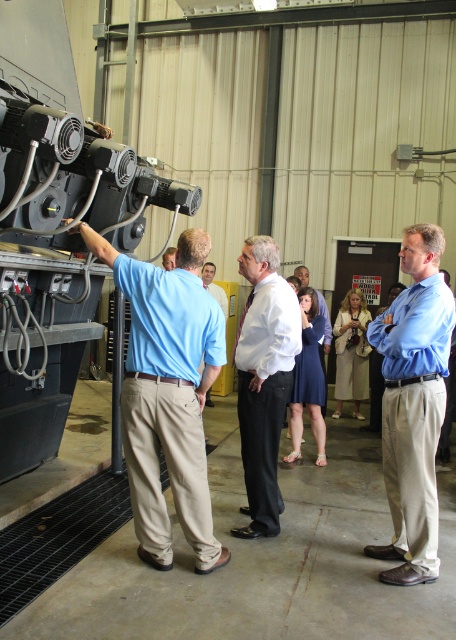
Does point (249, 324) lie in front of point (207, 284)?

Yes, it is in front of point (207, 284).

Does white dress shirt at center appear on the left side of blue shirt at center?

Incorrect, white dress shirt at center is not on the left side of blue shirt at center.

Where is `white dress shirt at center`? white dress shirt at center is located at coordinates (264, 380).

Is point (148, 275) positioned after point (208, 268)?

No, (148, 275) is closer to viewer.

The image size is (456, 640). Describe the element at coordinates (170, 321) in the screenshot. I see `matte blue shirt at left` at that location.

What are the coordinates of `matte blue shirt at left` in the screenshot? It's located at (170, 321).

Is point (198, 392) positioned behind point (259, 310)?

That is False.

The image size is (456, 640). In order to click on blue cotton shirt at left in this screenshot , I will do (x=167, y=394).

Locate an element on the screen. The height and width of the screenshot is (640, 456). blue cotton shirt at left is located at coordinates (167, 394).